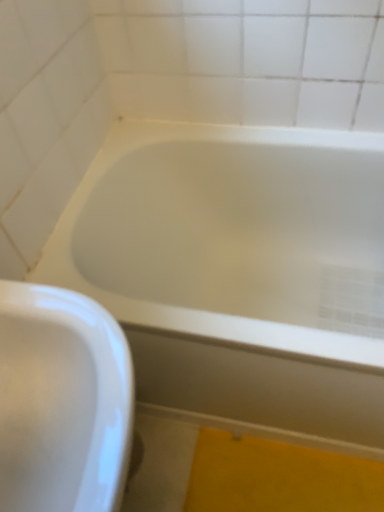
Question: Is white glossy bathtub at center in front of white glossy sink at lower left?

Choices:
 (A) no
 (B) yes

Answer: (A)

Question: Is white glossy sink at lower left inside white glossy bathtub at center?

Choices:
 (A) yes
 (B) no

Answer: (B)

Question: Is white glossy sink at lower left at the back of white glossy bathtub at center?

Choices:
 (A) yes
 (B) no

Answer: (B)

Question: Can you confirm if white glossy bathtub at center is taller than white glossy sink at lower left?

Choices:
 (A) no
 (B) yes

Answer: (A)

Question: Does white glossy bathtub at center have a smaller size compared to white glossy sink at lower left?

Choices:
 (A) yes
 (B) no

Answer: (B)

Question: From a real-world perspective, is white glossy bathtub at center physically below white glossy sink at lower left?

Choices:
 (A) no
 (B) yes

Answer: (B)

Question: Is white glossy sink at lower left further to the viewer compared to white glossy bathtub at center?

Choices:
 (A) no
 (B) yes

Answer: (A)

Question: Is white glossy sink at lower left outside of white glossy bathtub at center?

Choices:
 (A) no
 (B) yes

Answer: (B)

Question: Is white glossy sink at lower left touching white glossy bathtub at center?

Choices:
 (A) no
 (B) yes

Answer: (A)

Question: Is white glossy sink at lower left far away from white glossy bathtub at center?

Choices:
 (A) no
 (B) yes

Answer: (A)

Question: Is white glossy sink at lower left looking in the opposite direction of white glossy bathtub at center?

Choices:
 (A) yes
 (B) no

Answer: (B)

Question: Can you confirm if white glossy sink at lower left is taller than white glossy bathtub at center?

Choices:
 (A) yes
 (B) no

Answer: (A)

Question: Is white glossy sink at lower left situated inside white glossy bathtub at center or outside?

Choices:
 (A) inside
 (B) outside

Answer: (B)